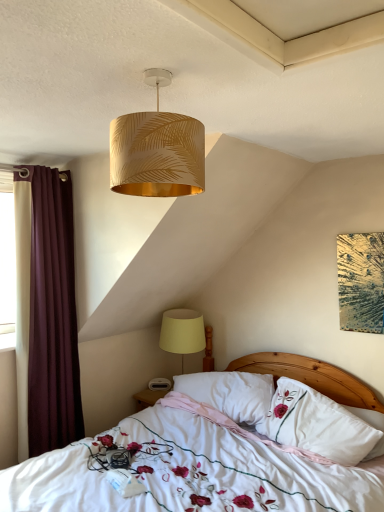
Question: From the image's perspective, would you say white floral fabric bed at center is shown under yellow fabric lampshade at lower center, the second lamp in the top-to-bottom sequence?

Choices:
 (A) no
 (B) yes

Answer: (B)

Question: Is white floral fabric bed at center oriented towards yellow fabric lampshade at lower center, the second lamp in the top-to-bottom sequence?

Choices:
 (A) yes
 (B) no

Answer: (B)

Question: Is white floral fabric bed at center thinner than yellow fabric lampshade at lower center, arranged as the second lamp when viewed from the front?

Choices:
 (A) no
 (B) yes

Answer: (A)

Question: Would you say white floral fabric bed at center is outside yellow fabric lampshade at lower center, which is the 1th lamp in back-to-front order?

Choices:
 (A) yes
 (B) no

Answer: (A)

Question: Does white floral fabric bed at center contain yellow fabric lampshade at lower center, which is the 1th lamp in back-to-front order?

Choices:
 (A) yes
 (B) no

Answer: (A)

Question: Is white soft pillow at center, acting as the first pillow starting from the right, wider or thinner than white soft pillow at center, the first pillow positioned from the left?

Choices:
 (A) wide
 (B) thin

Answer: (B)

Question: Looking at the image, does white soft pillow at center, acting as the first pillow starting from the right, seem bigger or smaller compared to white soft pillow at center, the first pillow positioned from the left?

Choices:
 (A) small
 (B) big

Answer: (B)

Question: Choose the correct answer: Is white soft pillow at center, acting as the first pillow starting from the right, inside white soft pillow at center, the first pillow positioned from the left, or outside it?

Choices:
 (A) outside
 (B) inside

Answer: (A)

Question: Considering the positions of point (357, 453) and point (205, 399), is point (357, 453) closer or farther from the camera than point (205, 399)?

Choices:
 (A) farther
 (B) closer

Answer: (B)

Question: In terms of height, does maroon fabric curtain at left look taller or shorter compared to gold leaf-patterned lampshade at upper center, the first lamp positioned from the top?

Choices:
 (A) short
 (B) tall

Answer: (B)

Question: Considering the positions of maroon fabric curtain at left and gold leaf-patterned lampshade at upper center, positioned as the second lamp in bottom-to-top order, in the image, is maroon fabric curtain at left bigger or smaller than gold leaf-patterned lampshade at upper center, positioned as the second lamp in bottom-to-top order,?

Choices:
 (A) big
 (B) small

Answer: (A)

Question: Is maroon fabric curtain at left in front of or behind gold leaf-patterned lampshade at upper center, positioned as the second lamp in bottom-to-top order, in the image?

Choices:
 (A) front
 (B) behind

Answer: (B)

Question: From a real-world perspective, is maroon fabric curtain at left positioned above or below gold leaf-patterned lampshade at upper center, positioned as the second lamp in bottom-to-top order?

Choices:
 (A) below
 (B) above

Answer: (A)

Question: Is point (18, 351) positioned closer to the camera than point (195, 348)?

Choices:
 (A) closer
 (B) farther

Answer: (A)

Question: From the image's perspective, is maroon fabric curtain at left located above or below yellow fabric lampshade at lower center, the first lamp in the bottom-to-top sequence?

Choices:
 (A) below
 (B) above

Answer: (B)